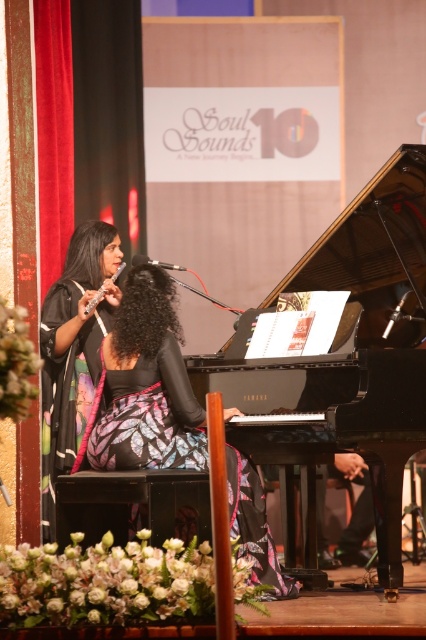
You are a photographer at the event and want to capture a photo of the black polished piano at center and the floral dress at center. Which object is taller in the image?

The black polished piano at center is much taller than the floral dress at center.

You are standing on the stage at the Soul Sounds 10 event and see two points marked on the floor. The first point is at position point (290,401) and the second is at point (51,388). If you were to walk from the first point to the second, would you be moving towards the audience or away from them?

Since point (290,401) is in front of point (51,388), moving from the first point to the second would mean walking away from the audience towards the back of the stage.

You are standing in the audience and want to see the sheet of music on the grand piano. The point where the sheet of music is located is represented by the coordinate point at (351,208). If your line of sight is blocked by a standing person who is 6 feet tall, how far in feet must you move forward to ensure you can see the sheet of music? Assume the person is standing directly in front of you at the same horizontal position as the point.

The point at (351,208) is 14.97 feet away from the viewer. To see over a 6 feet tall person blocking your view, you must move forward by approximately 14.97 feet minus the distance where the person obstructs the view. However, without knowing the exact height of the sheet of music, it is impossible to calculate the exact distance needed to move forward. Please provide the height of the sheet of music to proceed.